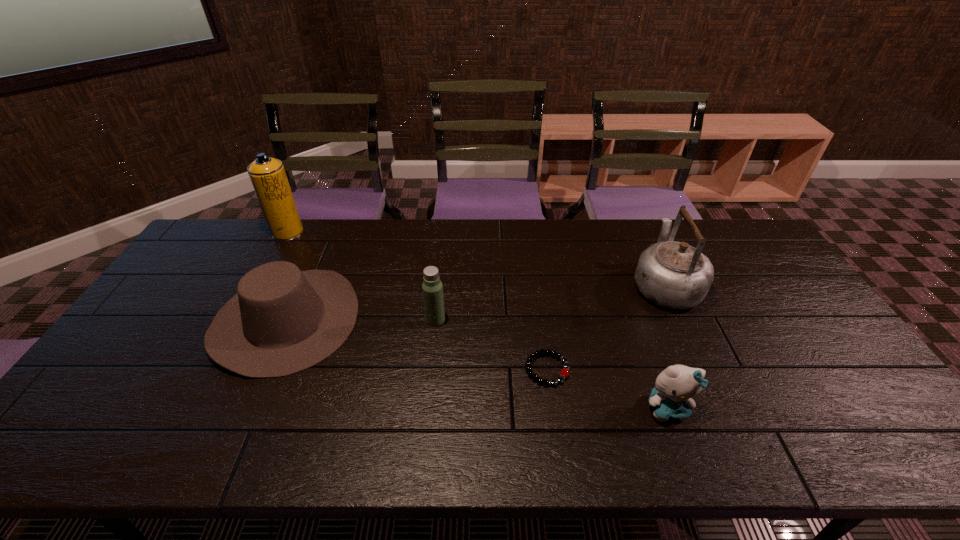
Locate an element on the screen. This screenshot has width=960, height=540. free space at the left edge is located at coordinates (112, 404).

Find the location of `blank space at the right edge of the desktop`. blank space at the right edge of the desktop is located at coordinates (806, 331).

The width and height of the screenshot is (960, 540). In the image, there is a desktop. Find the location of `free space at the far left corner`. free space at the far left corner is located at coordinates (246, 222).

At what (x,y) coordinates should I click in order to perform the action: click on vacant space at the far right corner of the desktop. Please return your answer as a coordinate pair (x, y). The width and height of the screenshot is (960, 540). Looking at the image, I should click on (738, 257).

Locate an element on the screen. This screenshot has height=540, width=960. vacant space at the near right corner is located at coordinates (892, 447).

At what (x,y) coordinates should I click in order to perform the action: click on vacant region between the kettle and the kitten. Please return your answer as a coordinate pair (x, y). Looking at the image, I should click on (666, 346).

The height and width of the screenshot is (540, 960). I want to click on empty space that is in between the cowboy hat and the second tallest object, so [475, 301].

I want to click on vacant region between the kitten and the fifth shortest object, so click(x=666, y=346).

Locate an element on the screen. free space between the tallest object and the second tallest object is located at coordinates (476, 258).

I want to click on empty location between the aerosol can and the third tallest object, so click(x=362, y=276).